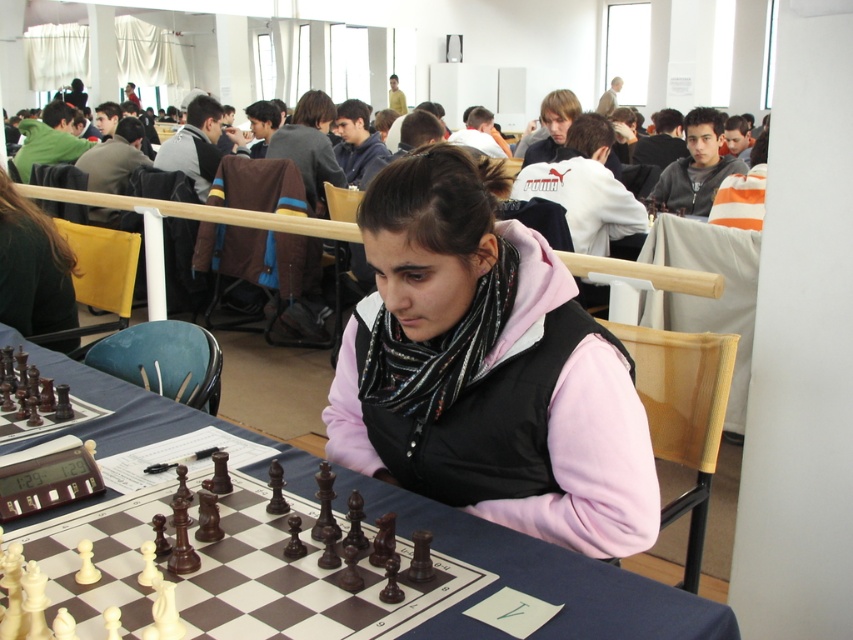
You are organizing a chess tournament and need to place a wooden chess set at center and a wooden chessboard at center on a table. Given their sizes, which object will require more space on the table?

The wooden chessboard at center requires more space on the table because the wooden chess set at center occupies less space than it.

You are a photographer trying to capture a closeup of both the pink fleece vest at center and the wooden chess set at center in the scene. Since you want both subjects to be clearly visible, which object should you focus on first to ensure proper framing?

The pink fleece vest at center has a lesser width compared to the wooden chess set at center, so you should focus on the wooden chess set at center first as it takes up more space and will require more attention to frame properly.

You are a chess player observing the scene. You notice both the wooden chess set at center and the wooden chessboard at center. Which object is positioned lower in the image?

The wooden chess set at center is positioned below the wooden chessboard at center, so it is lower in the image.